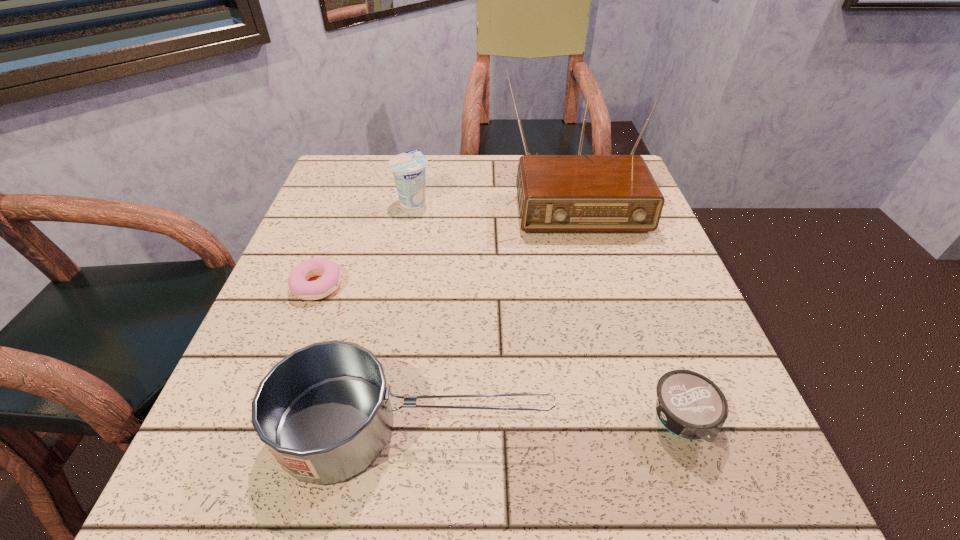
This screenshot has height=540, width=960. Identify the location of free space that satisfies the following two spatial constraints: 1. on the front panel of the radio_receiver; 2. with the handle extending from one side of the saucepan. (636, 428).